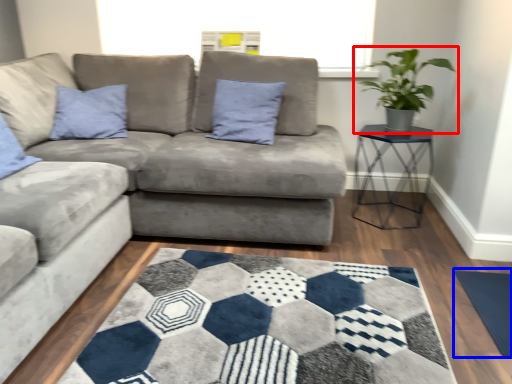
Question: Which object is further to the camera taking this photo, houseplant (highlighted by a red box) or yoga mat (highlighted by a blue box)?

Choices:
 (A) houseplant
 (B) yoga mat

Answer: (A)